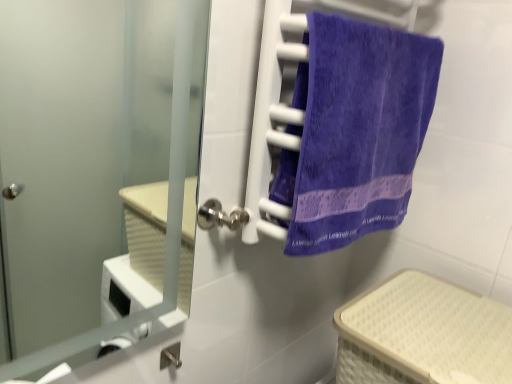
This screenshot has width=512, height=384. In order to click on beige woven basket at lower right in this screenshot , I will do [x=423, y=334].

Identify the location of satin silver door at center. (98, 169).

At what (x,y) coordinates should I click in order to perform the action: click on beige woven basket at lower right. Please return your answer as a coordinate pair (x, y). Looking at the image, I should click on (423, 334).

Is purple terry cloth towel at right to the right of satin silver door at center from the viewer's perspective?

Correct, you'll find purple terry cloth towel at right to the right of satin silver door at center.

Locate an element on the screen. Image resolution: width=512 pixels, height=384 pixels. door that appears below the purple terry cloth towel at right (from the image's perspective) is located at coordinates (98, 169).

From the image's perspective, is purple terry cloth towel at right located above or below satin silver door at center?

purple terry cloth towel at right is situated higher than satin silver door at center in the image.

Which object is positioned more to the right, beige woven basket at lower right or purple terry cloth towel at right?

beige woven basket at lower right is more to the right.

Is beige woven basket at lower right positioned far away from purple terry cloth towel at right?

No, there isn't a large distance between beige woven basket at lower right and purple terry cloth towel at right.

Considering the sizes of beige woven basket at lower right and purple terry cloth towel at right in the image, is beige woven basket at lower right bigger or smaller than purple terry cloth towel at right?

Considering their sizes, beige woven basket at lower right takes up more space than purple terry cloth towel at right.

Is purple terry cloth towel at right located within beige woven basket at lower right?

No, beige woven basket at lower right does not contain purple terry cloth towel at right.

Does satin silver door at center appear on the right side of purple terry cloth towel at right?

No, satin silver door at center is not to the right of purple terry cloth towel at right.

Are satin silver door at center and purple terry cloth towel at right located far from each other?

That's not correct — satin silver door at center is a little close to purple terry cloth towel at right.

How different are the orientations of satin silver door at center and purple terry cloth towel at right in degrees?

0.000157 degrees.

Considering the relative positions of satin silver door at center and purple terry cloth towel at right in the image provided, is satin silver door at center behind purple terry cloth towel at right?

No, satin silver door at center is in front of purple terry cloth towel at right.

Is beige woven basket at lower right smaller than satin silver door at center?

Incorrect, beige woven basket at lower right is not smaller in size than satin silver door at center.

From the image's perspective, between beige woven basket at lower right and satin silver door at center, which one is located above?

satin silver door at center is shown above in the image.

Does beige woven basket at lower right come behind satin silver door at center?

That is True.

From a real-world perspective, does beige woven basket at lower right sit lower than satin silver door at center?

Yes, from a real-world perspective, beige woven basket at lower right is below satin silver door at center.

Is purple terry cloth towel at right oriented away from beige woven basket at lower right?

No, purple terry cloth towel at right is not facing the opposite direction of beige woven basket at lower right.

What's the angular difference between purple terry cloth towel at right and beige woven basket at lower right's facing directions?

89.1 degrees separate the facing orientations of purple terry cloth towel at right and beige woven basket at lower right.

Locate an element on the screen. This screenshot has width=512, height=384. towel above the beige woven basket at lower right (from the image's perspective) is located at coordinates (355, 131).

From the image's perspective, who appears lower, purple terry cloth towel at right or beige woven basket at lower right?

beige woven basket at lower right.

Considering the sizes of objects satin silver door at center and beige woven basket at lower right in the image provided, who is bigger, satin silver door at center or beige woven basket at lower right?

With larger size is beige woven basket at lower right.

Is satin silver door at center turned away from beige woven basket at lower right?

No, satin silver door at center is not facing away from beige woven basket at lower right.

Which of these two, satin silver door at center or beige woven basket at lower right, stands taller?

With more height is satin silver door at center.

From the image's perspective, between satin silver door at center and beige woven basket at lower right, who is located below?

beige woven basket at lower right appears lower in the image.

Image resolution: width=512 pixels, height=384 pixels. What are the coordinates of `door on the left of purple terry cloth towel at right` in the screenshot? It's located at (98, 169).

Locate an element on the screen. Image resolution: width=512 pixels, height=384 pixels. basket below the purple terry cloth towel at right (from a real-world perspective) is located at coordinates pyautogui.click(x=423, y=334).

Considering their positions, is purple terry cloth towel at right positioned closer to satin silver door at center than beige woven basket at lower right?

purple terry cloth towel at right.

Which object lies further to the anchor point beige woven basket at lower right, purple terry cloth towel at right or satin silver door at center?

satin silver door at center is positioned further to the anchor beige woven basket at lower right.

Looking at the image, which one is located further to beige woven basket at lower right, satin silver door at center or purple terry cloth towel at right?

satin silver door at center.

Based on their spatial positions, is beige woven basket at lower right or purple terry cloth towel at right closer to satin silver door at center?

purple terry cloth towel at right lies closer to satin silver door at center than the other object.

Estimate the real-world distances between objects in this image. Which object is further from purple terry cloth towel at right, beige woven basket at lower right or satin silver door at center?

satin silver door at center is positioned further to the anchor purple terry cloth towel at right.

When comparing their distances from purple terry cloth towel at right, does satin silver door at center or beige woven basket at lower right seem further?

satin silver door at center is positioned further to the anchor purple terry cloth towel at right.

Locate an element on the screen. The height and width of the screenshot is (384, 512). towel between satin silver door at center and beige woven basket at lower right in the horizontal direction is located at coordinates coord(355,131).